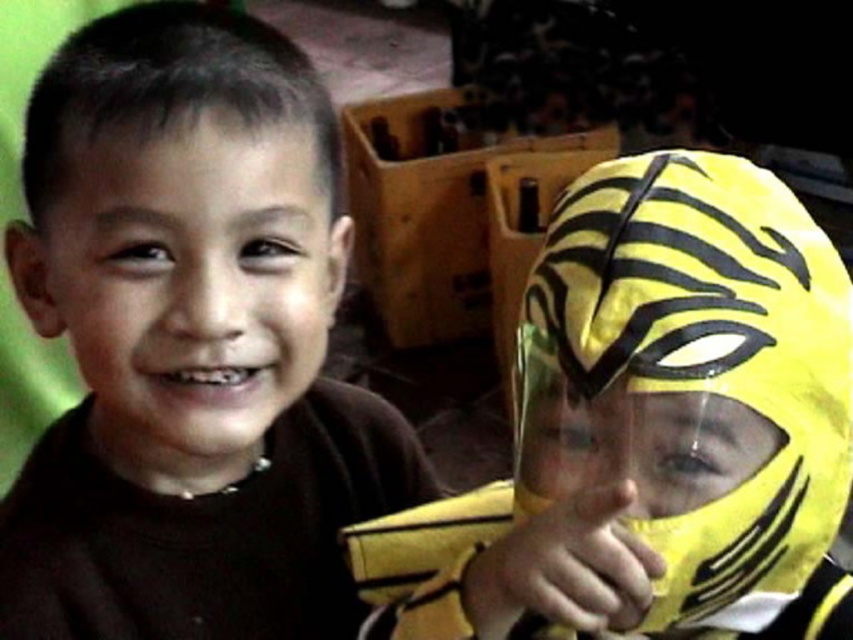
Is brown matte shirt at center above matte brown face at left?

No, brown matte shirt at center is not above matte brown face at left.

Between brown matte shirt at center and matte brown face at left, which one is positioned lower?

brown matte shirt at center is below.

What do you see at coordinates (190, 342) in the screenshot? The width and height of the screenshot is (853, 640). I see `brown matte shirt at center` at bounding box center [190, 342].

You are a GUI agent. You are given a task and a screenshot of the screen. Output one action in this format:
    pyautogui.click(x=<x>, y=<y>)
    Task: Click on the brown matte shirt at center
    The height and width of the screenshot is (640, 853).
    Given the screenshot: What is the action you would take?
    pyautogui.click(x=190, y=342)

Which is in front, point (39, 300) or point (526, 310)?

Point (526, 310) is in front.

Does brown matte shirt at center have a larger size compared to yellow fabric mask at right?

Yes.

The image size is (853, 640). I want to click on brown matte shirt at center, so click(x=190, y=342).

Between yellow fabric mask at right and matte brown face at left, which one appears on the left side from the viewer's perspective?

matte brown face at left is more to the left.

Between yellow fabric mask at right and matte brown face at left, which one is positioned lower?

yellow fabric mask at right is lower down.

Between point (779, 184) and point (94, 424), which one is positioned behind?

The point (94, 424) is behind.

The image size is (853, 640). In order to click on yellow fabric mask at right in this screenshot , I will do `click(651, 429)`.